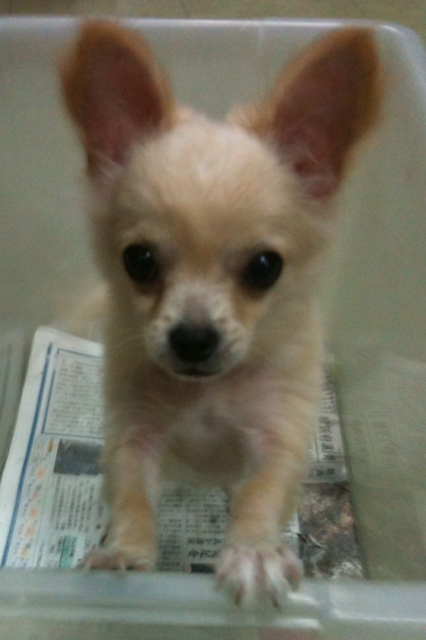
Identify the location of newspaper. (195, 512), (66, 444), (338, 504).